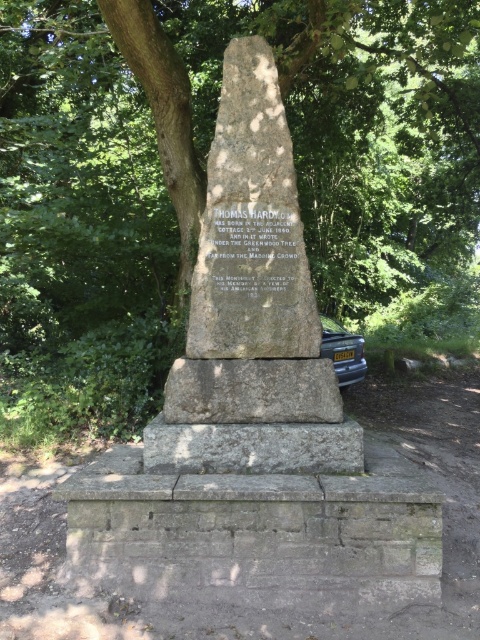
Can you confirm if gray stone monument at center is bigger than metallic gray car at lower right?

No, gray stone monument at center is not bigger than metallic gray car at lower right.

Between gray stone monument at center and metallic gray car at lower right, which one has less height?

Standing shorter between the two is metallic gray car at lower right.

Is point (298, 324) farther from viewer compared to point (338, 348)?

No, it is not.

Identify the location of gray stone monument at center. (252, 308).

Is green leafy tree at center below granite stone monument at center?

No.

Is point (432, 230) behind point (225, 214)?

Yes.

From the picture: Who is more distant from viewer, (327, 179) or (286, 326)?

The point (327, 179) is behind.

This screenshot has width=480, height=640. I want to click on green leafy tree at center, so click(210, 140).

Can you confirm if granite stone monument at center is positioned above metallic gray car at lower right?

Yes, granite stone monument at center is above metallic gray car at lower right.

Measure the distance between granite stone monument at center and camera.

granite stone monument at center and camera are 3.71 meters apart from each other.

Between point (241, 115) and point (320, 355), which one is positioned in front?

Point (320, 355) is in front.

At what (x,y) coordinates should I click in order to perform the action: click on granite stone monument at center. Please return your answer as a coordinate pair (x, y). Looking at the image, I should click on (251, 225).